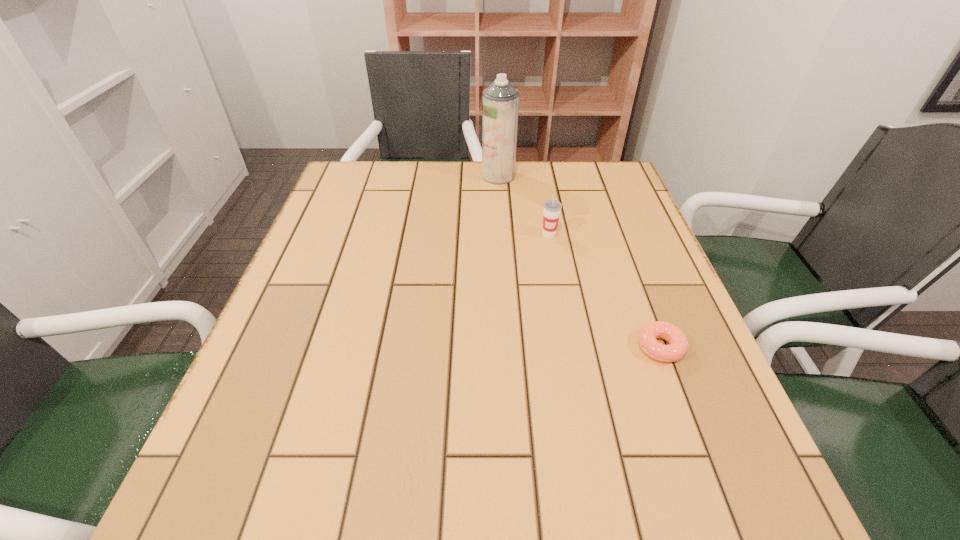
Find the location of a particular element. free region that satisfies the following two spatial constraints: 1. on the side of the rightmost object with the logo; 2. on the right side of the second object from left to right is located at coordinates (570, 347).

At what (x,y) coordinates should I click in order to perform the action: click on vacant space that satisfies the following two spatial constraints: 1. on the side of the second farthest object with the logo; 2. on the left side of the doughnut. Please return your answer as a coordinate pair (x, y). This screenshot has height=540, width=960. Looking at the image, I should click on (570, 347).